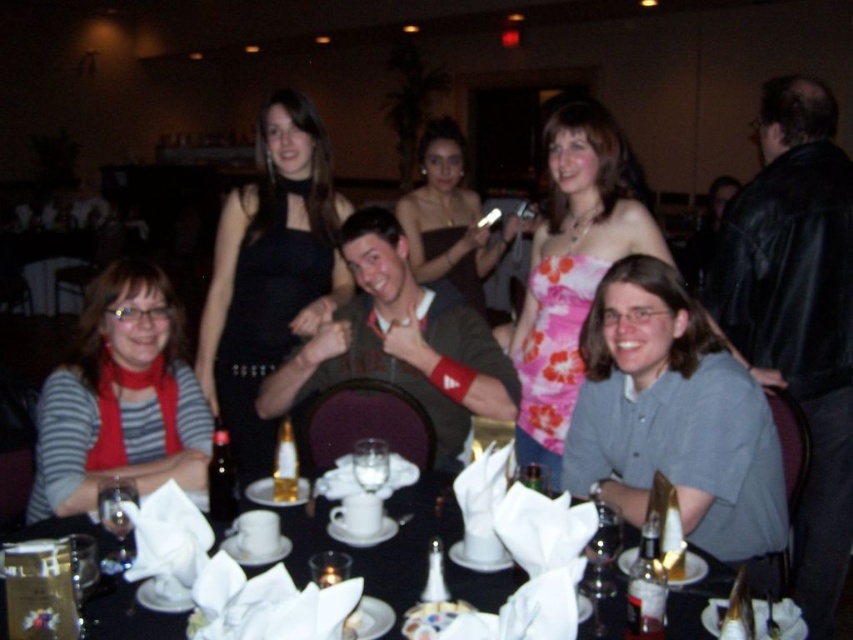
Can you confirm if pink floral dress at center is taller than white porcelain cup at center?

Correct, pink floral dress at center is much taller as white porcelain cup at center.

Who is positioned more to the left, pink floral dress at center or white porcelain cup at center?

Positioned to the left is white porcelain cup at center.

The width and height of the screenshot is (853, 640). What do you see at coordinates (572, 269) in the screenshot?
I see `pink floral dress at center` at bounding box center [572, 269].

Where is `pink floral dress at center`? pink floral dress at center is located at coordinates pyautogui.click(x=572, y=269).

Based on the photo, who is positioned more to the right, white napkin at lower center or matte black dress at center?

matte black dress at center is more to the right.

Can you confirm if white napkin at lower center is wider than matte black dress at center?

Indeed, white napkin at lower center has a greater width compared to matte black dress at center.

Image resolution: width=853 pixels, height=640 pixels. What are the coordinates of `white napkin at lower center` in the screenshot? It's located at (381, 544).

Identify the location of white napkin at lower center. The height and width of the screenshot is (640, 853). (381, 544).

Measure the distance from matte black dress at center to white porcelain cup at center.

1.38 meters

In the scene shown: Is matte black dress at center further to camera compared to white porcelain cup at center?

That is True.

Between point (456, 268) and point (387, 452), which one is positioned behind?

The point (456, 268) is more distant.

This screenshot has width=853, height=640. I want to click on matte black dress at center, so click(x=450, y=218).